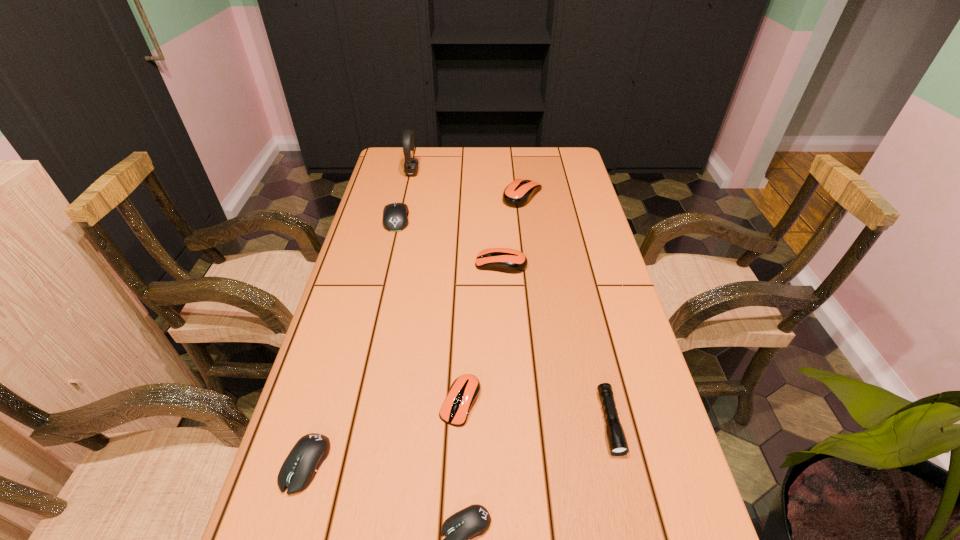
This screenshot has width=960, height=540. In order to click on the smallest orange computer mouse in this screenshot , I will do `click(464, 391)`.

Locate an element on the screen. This screenshot has width=960, height=540. vacant space located on the front-facing side of the tallest object is located at coordinates (475, 173).

The image size is (960, 540). I want to click on free space located 0.350m on the left of the farthest orange computer mouse, so click(401, 195).

The height and width of the screenshot is (540, 960). In order to click on vacant region located 0.260m on the back of the farthest black computer equipment in this screenshot , I will do `click(409, 167)`.

Find the location of `free location located 0.110m on the left of the fourth farthest object`. free location located 0.110m on the left of the fourth farthest object is located at coordinates (437, 264).

Where is `free space located 0.300m on the right of the second nearest computer equipment`? The height and width of the screenshot is (540, 960). free space located 0.300m on the right of the second nearest computer equipment is located at coordinates [484, 464].

Identify the location of free location located at the lens end of the black flashlight. (635, 530).

I want to click on free region located on the left of the fourth farthest computer equipment, so 375,402.

Image resolution: width=960 pixels, height=540 pixels. Identify the location of object that is at the far edge. (411, 167).

Image resolution: width=960 pixels, height=540 pixels. What are the coordinates of `headset that is positioned at the left edge` in the screenshot? It's located at (411, 167).